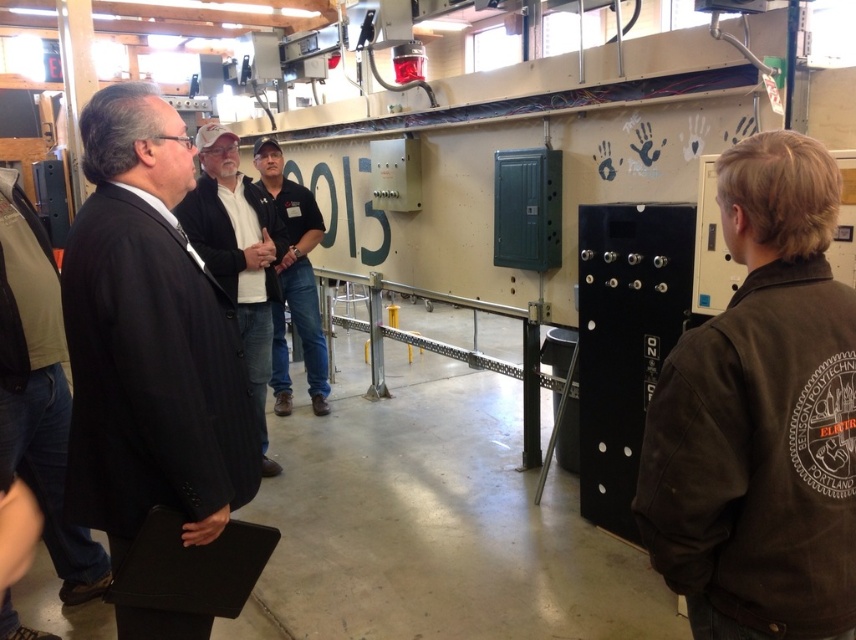
Question: Estimate the real-world distances between objects in this image. Which object is closer to the black denim jeans at center?

Choices:
 (A) dark suit at left
 (B) black pinstripe suit at left

Answer: (A)

Question: Does dark gray suit at center have a greater width compared to black denim jeans at center?

Choices:
 (A) yes
 (B) no

Answer: (A)

Question: Which point appears farthest from the camera in this image?

Choices:
 (A) (171, 452)
 (B) (221, 224)
 (C) (718, 568)
 (D) (4, 364)

Answer: (B)

Question: Which of the following is the farthest from the observer?

Choices:
 (A) (236, 289)
 (B) (42, 356)

Answer: (A)

Question: Can you confirm if brown corduroy jacket at right is smaller than dark gray suit at center?

Choices:
 (A) no
 (B) yes

Answer: (B)

Question: Is brown corduroy jacket at right further to the viewer compared to dark gray suit at center?

Choices:
 (A) yes
 (B) no

Answer: (B)